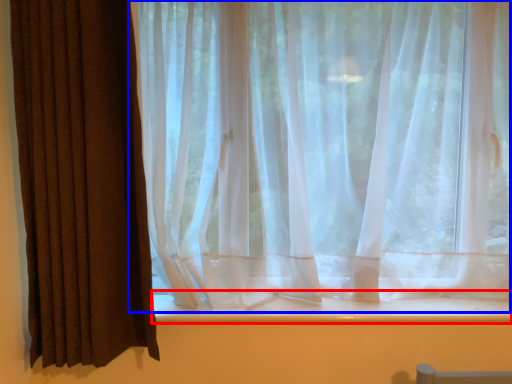
Question: Which object is closer to the camera taking this photo, window sill (highlighted by a red box) or curtain (highlighted by a blue box)?

Choices:
 (A) window sill
 (B) curtain

Answer: (B)